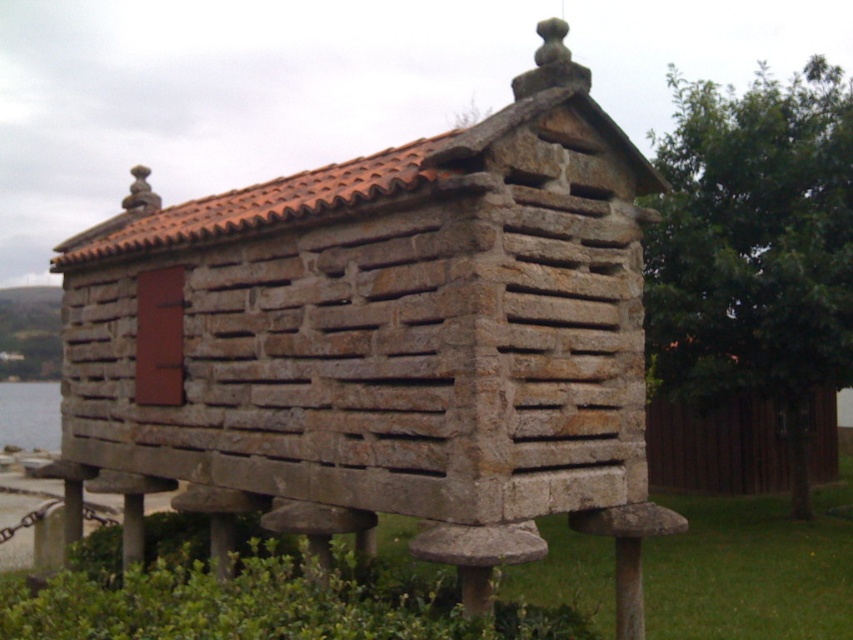
Does natural stone hut at center come in front of clear water at lower left?

Yes, natural stone hut at center is in front of clear water at lower left.

Find the location of a particular element. The width and height of the screenshot is (853, 640). natural stone hut at center is located at coordinates (384, 342).

Is point (291, 486) more distant than point (643, 547)?

No.

Which is in front, point (532, 186) or point (157, 572)?

Positioned in front is point (532, 186).

Between point (200, 448) and point (782, 588), which one is positioned behind?

Positioned behind is point (782, 588).

Locate an element on the screen. natural stone hut at center is located at coordinates (384, 342).

Consider the image. Is green grass at lower center shorter than clear water at lower left?

Indeed, green grass at lower center has a lesser height compared to clear water at lower left.

Based on the photo, who is positioned more to the left, green grass at lower center or clear water at lower left?

From the viewer's perspective, clear water at lower left appears more on the left side.

Is point (843, 616) positioned before point (1, 413)?

Yes, it is in front of point (1, 413).

You are a GUI agent. You are given a task and a screenshot of the screen. Output one action in this format:
    pyautogui.click(x=<x>, y=<y>)
    Task: Click on the green grass at lower center
    
    Given the screenshot: What is the action you would take?
    pyautogui.click(x=244, y=602)